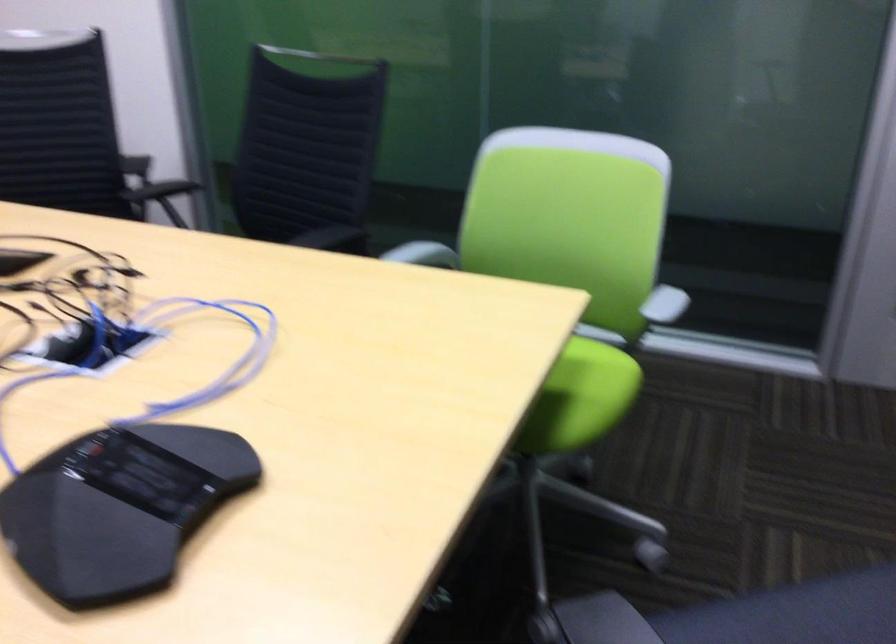
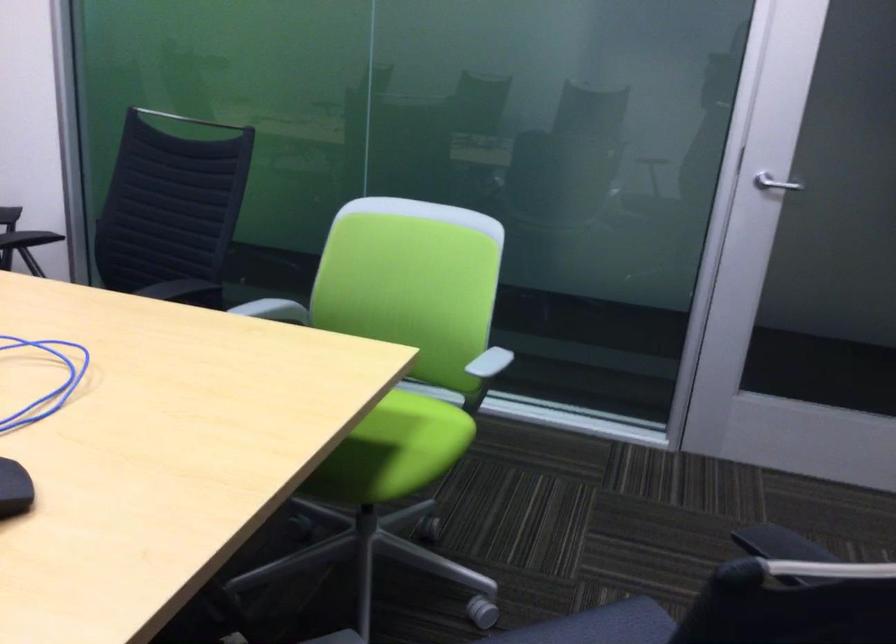
From the picture: What movement of the cameraman would produce the second image?

The cameraman walked toward right, backward.